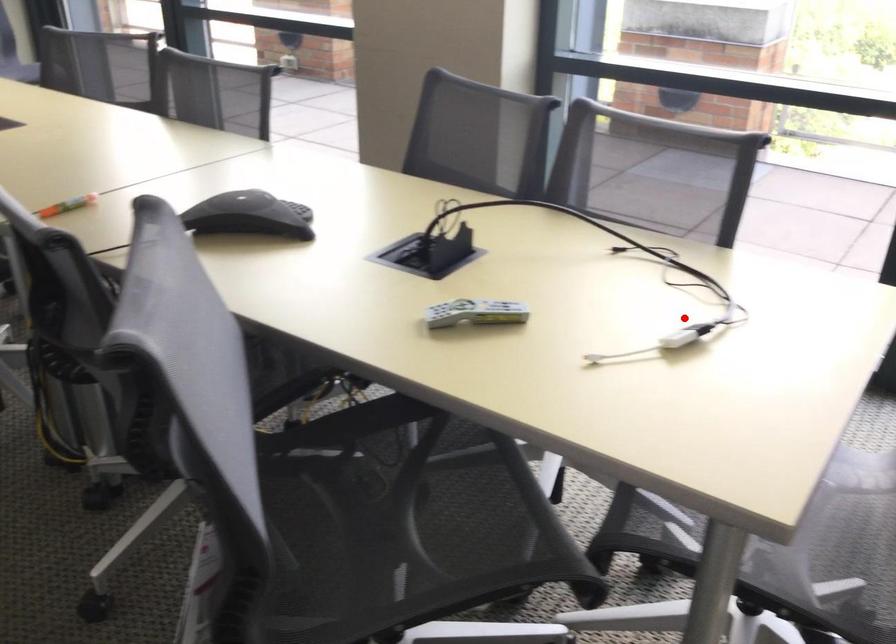
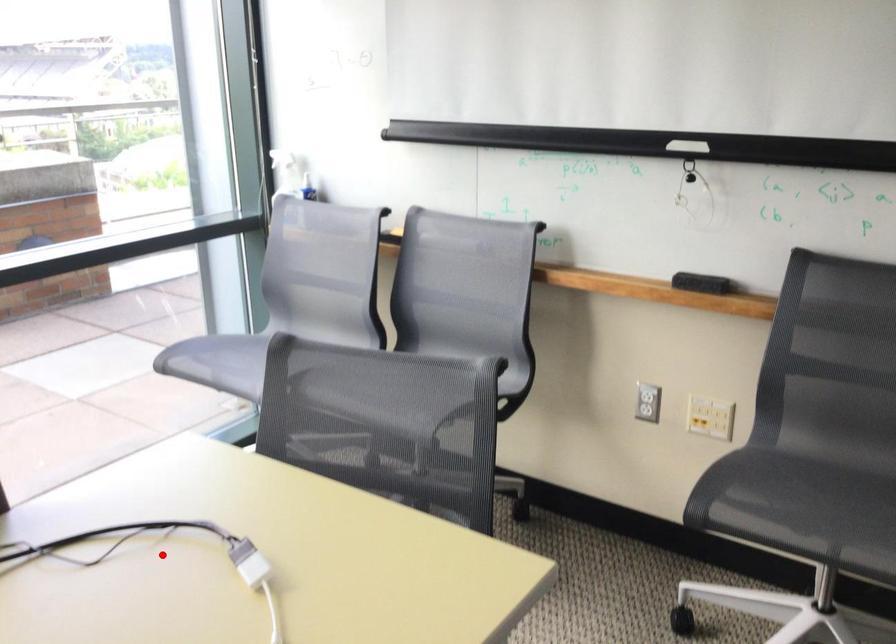
I am providing you with two images of the same scene from different viewpoints. A red point is marked on the first image and another point is marked on the second image. Are the points marked in image1 and image2 representing the same 3D position?

Yes